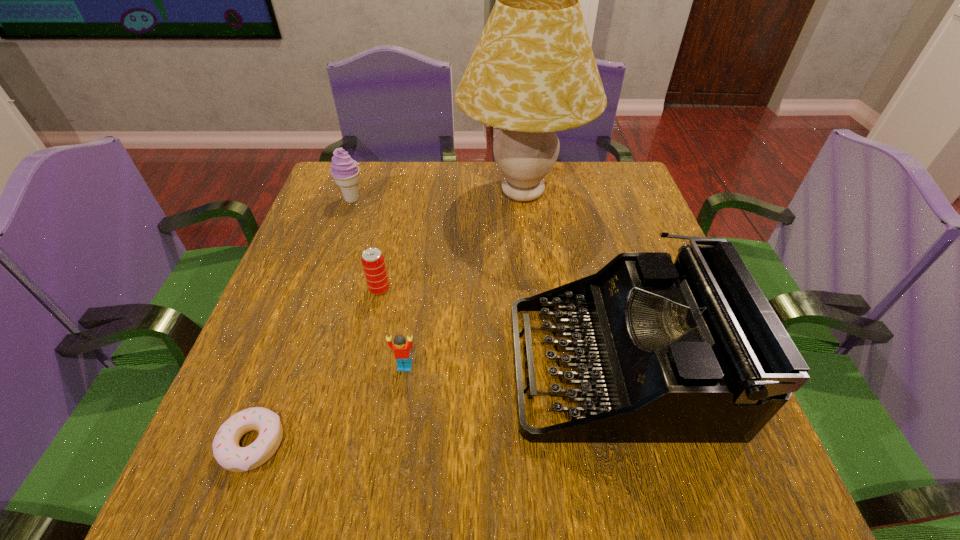
You are a GUI agent. You are given a task and a screenshot of the screen. Output one action in this format:
    pyautogui.click(x=<x>, y=<y>)
    Task: Click on the free space located 0.240m on the typing side of the fifth shortest object
    This screenshot has height=540, width=960.
    Given the screenshot: What is the action you would take?
    pyautogui.click(x=387, y=364)

This screenshot has height=540, width=960. Identify the location of vacant space positioned 0.320m on the typing side of the fifth shortest object. (345, 364).

Where is `vacant point located on the right of the icecream`? vacant point located on the right of the icecream is located at coordinates (435, 200).

Find the location of a particular element. The image size is (960, 540). vacant space located 0.340m on the right of the fourth object from right to left is located at coordinates (544, 289).

This screenshot has height=540, width=960. I want to click on blank space located 0.200m on the face of the Lego, so click(x=389, y=483).

Identify the location of vacant space located 0.080m on the right of the shortest object. Image resolution: width=960 pixels, height=540 pixels. (332, 444).

Locate an element on the screen. lampshade positioned at the far edge is located at coordinates [533, 72].

Locate an element on the screen. icecream that is positioned at the far edge is located at coordinates (344, 170).

Locate an element on the screen. This screenshot has height=540, width=960. object situated at the near edge is located at coordinates (226, 450).

This screenshot has width=960, height=540. I want to click on icecream at the left edge, so pos(344,170).